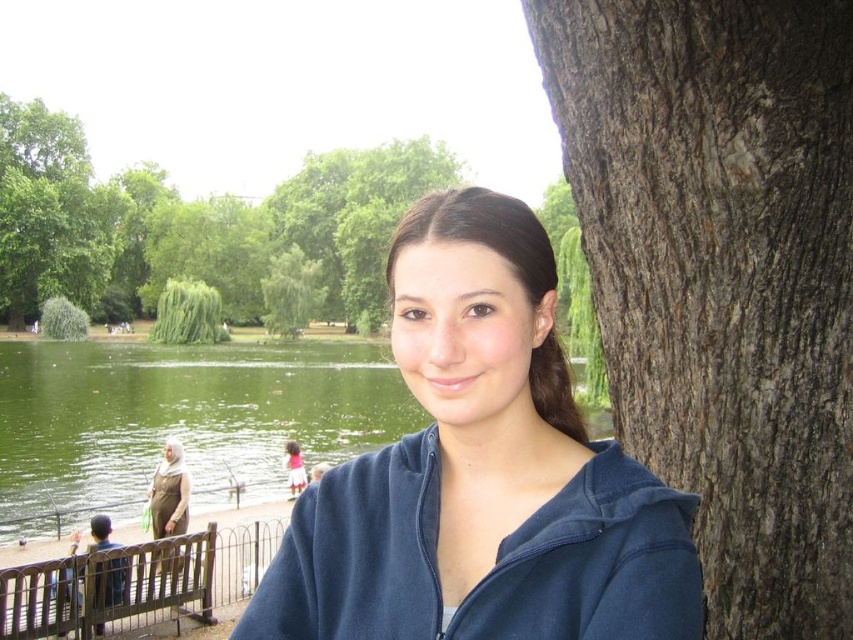
Question: Among these points, which one is nearest to the camera?

Choices:
 (A) (646, 358)
 (B) (633, 500)

Answer: (B)

Question: Is brown wooden bench at lower left below matte blue sweatshirt at center?

Choices:
 (A) no
 (B) yes

Answer: (B)

Question: Which object is farther from the camera taking this photo?

Choices:
 (A) green leafy tree at center
 (B) dark blue fleece at center

Answer: (A)

Question: Is blue fleece jacket at center in front of green leafy tree at center?

Choices:
 (A) no
 (B) yes

Answer: (B)

Question: Among these points, which one is farthest from the camera?

Choices:
 (A) (740, 532)
 (B) (660, 600)

Answer: (A)

Question: Observing the image, what is the correct spatial positioning of dark brown rough bark at right in reference to green leafy tree at center?

Choices:
 (A) right
 (B) left

Answer: (A)